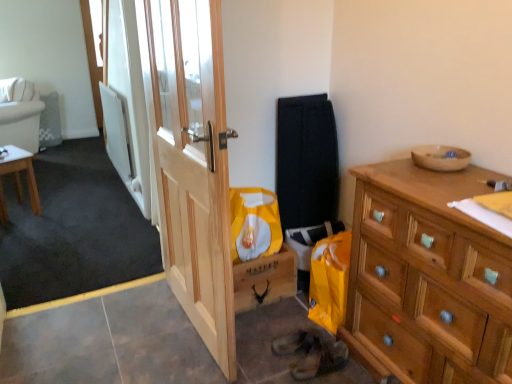
Where is `free point in front of natural wood door at center`? The image size is (512, 384). free point in front of natural wood door at center is located at coordinates (170, 360).